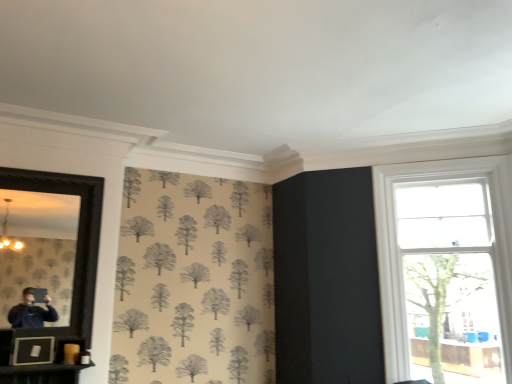
Question: From the image's perspective, relative to clear glass window at right, is matte black picture frame at lower left above or below?

Choices:
 (A) below
 (B) above

Answer: (A)

Question: From a real-world perspective, is matte black picture frame at lower left above or below clear glass window at right?

Choices:
 (A) above
 (B) below

Answer: (B)

Question: Estimate the real-world distances between objects in this image. Which object is closer to the clear glass window at right?

Choices:
 (A) matte black picture frame at lower left
 (B) black framed mirror at left

Answer: (B)

Question: Which object is the farthest from the clear glass window at right?

Choices:
 (A) matte black picture frame at lower left
 (B) black framed mirror at left

Answer: (A)